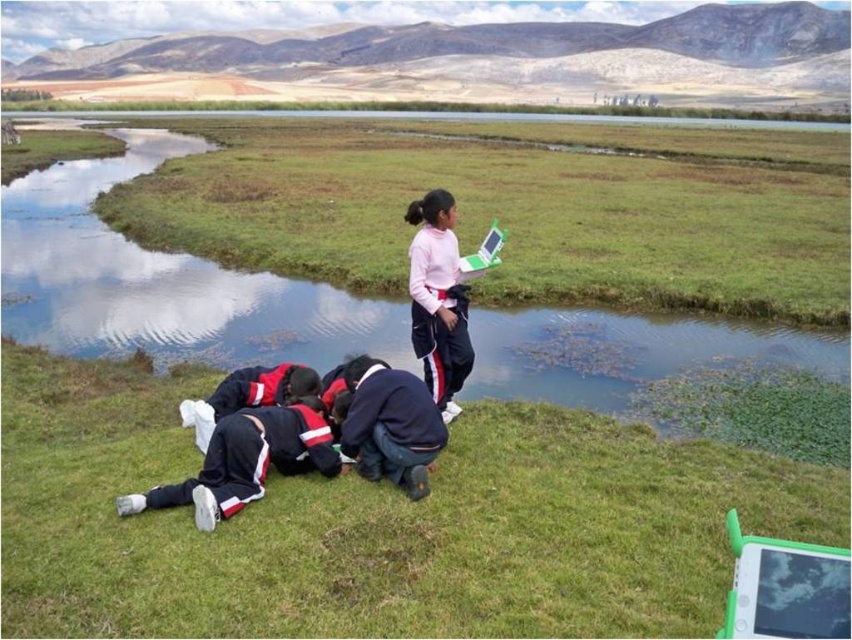
You are a participant in the outdoor activity and you need to find the green grass at lower center. Where should you look relative to the dark blue fabric pants at lower center?

The green grass at lower center is to the left of the dark blue fabric pants at lower center, so you should look to the left side of the dark blue fabric pants at lower center to find it.

You are a photographer positioned at the dark blue tracksuit at lower left and need to capture a photo of the pink matte sweater at upper center. Considering the distance between them is 1.70 meters, can you fit both subjects in the frame without moving the camera?

Yes, since the distance between the dark blue tracksuit at lower left and the pink matte sweater at upper center is 1.70 meters, which is manageable within a standard camera frame without needing to move the camera.

You are a photographer positioned at the edge of the scene. You want to capture a photo that includes both the green plastic creek at center and the dark blue fabric pants at lower center. Which object should you adjust your camera focus to first to ensure both are in clear view?

The green plastic creek at center is further to the viewer than the dark blue fabric pants at lower center. To ensure both are in clear view, adjust focus starting with the green plastic creek at center since it is closer, then adjust for the dark blue fabric pants at lower center which is farther away.